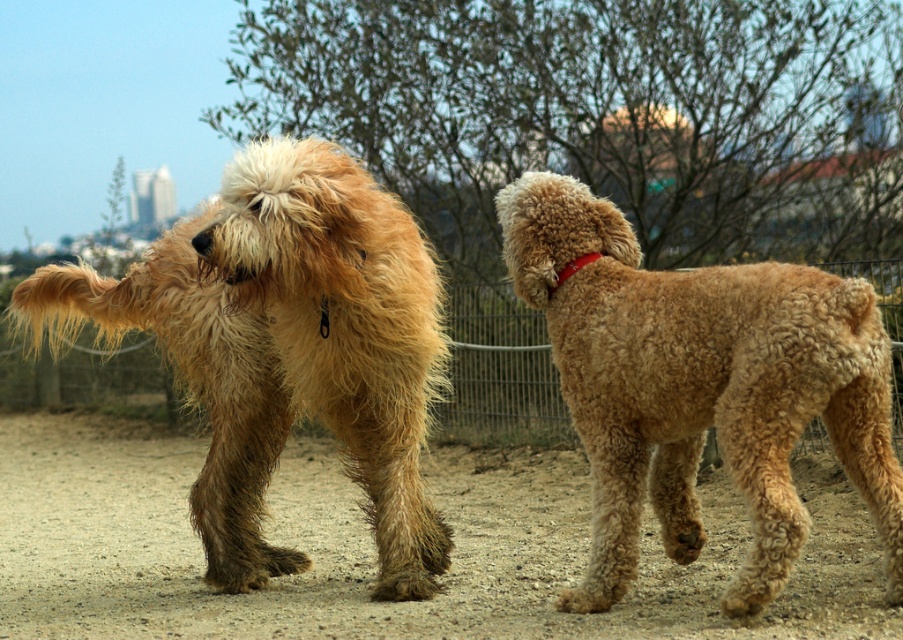
You are a photographer trying to capture a clear photo of the golden curly fur dog at center and the red leather collar at upper right. Since you want both subjects to be in focus, which one should you focus on first to ensure the other is also sharp?

You should focus on the golden curly fur dog at center first because it is closer to the viewer than the red leather collar at upper right, so focusing on the closer subject will help keep both in focus.

You are a photographer trying to capture a photo of both dogs in the image. You notice two points marked on the image, point A at coordinates point[712,477] and point B at coordinates point[247,438]. Which point is closer to your camera lens?

Point B at coordinates point[247,438] is closer to the camera lens because it is positioned behind point A, which is further away from the camera.